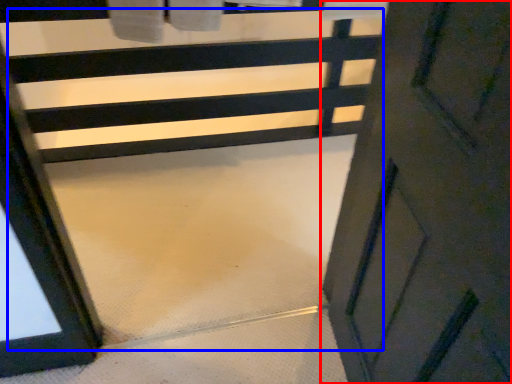
Question: Which object is further to the camera taking this photo, door (highlighted by a red box) or stair (highlighted by a blue box)?

Choices:
 (A) door
 (B) stair

Answer: (B)